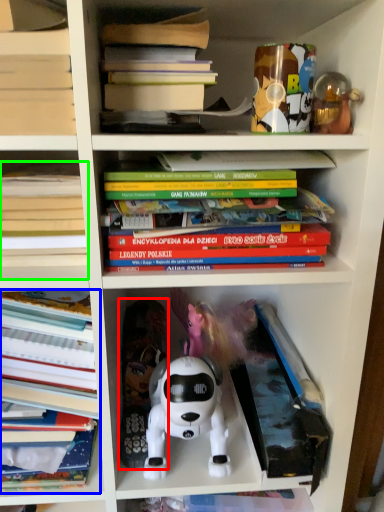
Question: Which object is the closest to the toy (highlighted by a red box)? Choose among these: book (highlighted by a blue box) or book (highlighted by a green box).

Choices:
 (A) book
 (B) book

Answer: (A)